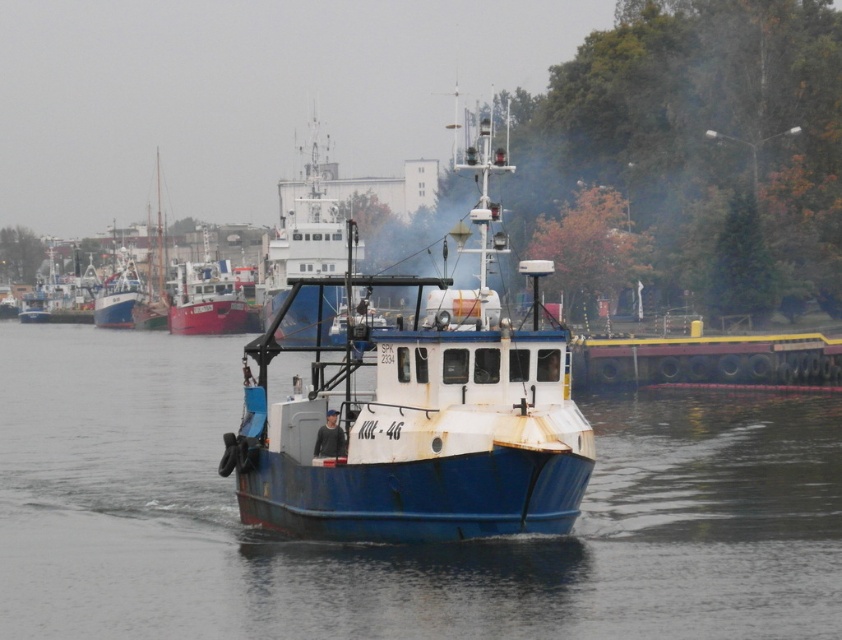
Question: Which point is closer to the camera taking this photo?

Choices:
 (A) pos(377,556)
 (B) pos(233,321)
 (C) pos(260,458)
 (D) pos(72,308)

Answer: (A)

Question: Considering the real-world distances, which object is closest to the blue metallic boat at center?

Choices:
 (A) rustic wooden ship at center
 (B) rusty metal boat at left
 (C) rusty metal boat at center

Answer: (C)

Question: Can you confirm if rusty metal boat at center is positioned to the right of rustic wooden ship at center?

Choices:
 (A) no
 (B) yes

Answer: (B)

Question: Is blue metallic boat at center to the right of rustic wooden ship at center from the viewer's perspective?

Choices:
 (A) no
 (B) yes

Answer: (B)

Question: Does rusty metal boat at center appear over rustic wooden ship at center?

Choices:
 (A) no
 (B) yes

Answer: (B)

Question: Among these points, which one is farthest from the camera?

Choices:
 (A) (41, 284)
 (B) (201, 317)

Answer: (A)